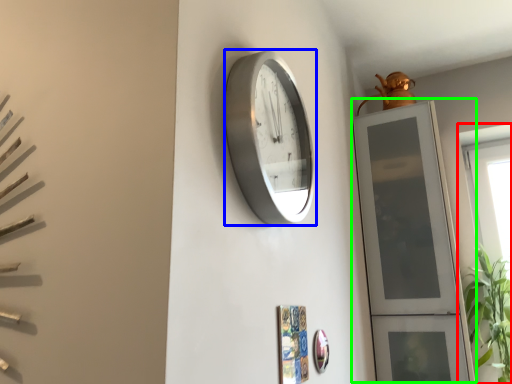
Question: Considering the real-world distances, which object is farthest from window (highlighted by a red box)? wall clock (highlighted by a blue box) or glass door (highlighted by a green box)?

Choices:
 (A) wall clock
 (B) glass door

Answer: (A)